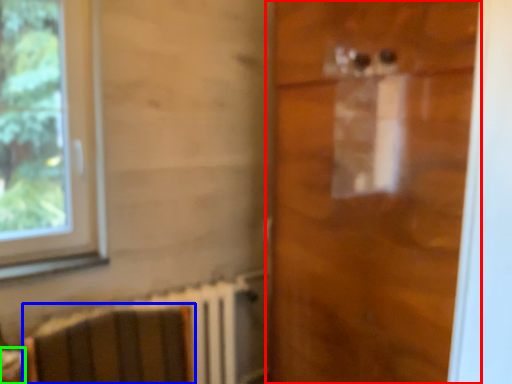
Question: Which object is the farthest from door (highlighted by a red box)? Choose among these: armchair (highlighted by a blue box) or table (highlighted by a green box).

Choices:
 (A) armchair
 (B) table

Answer: (B)